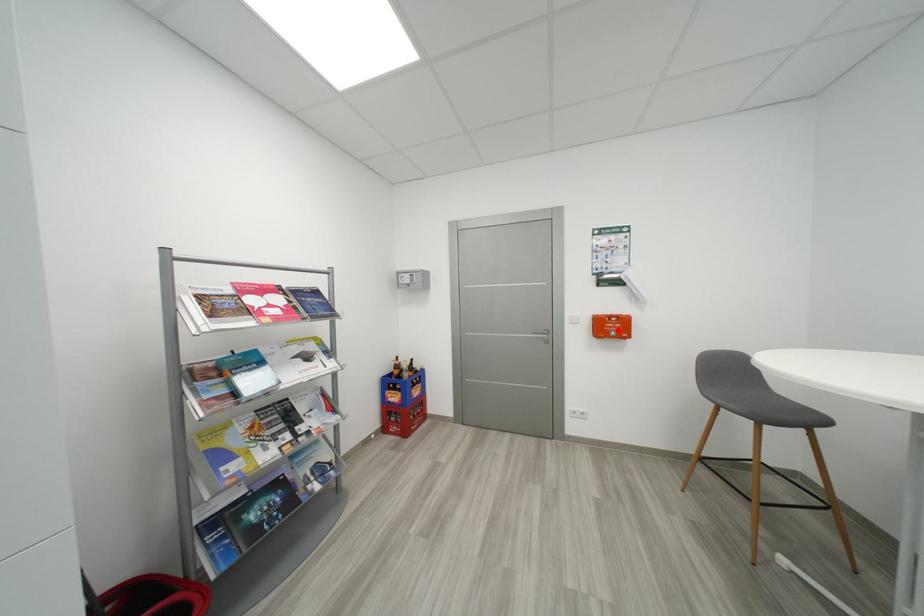
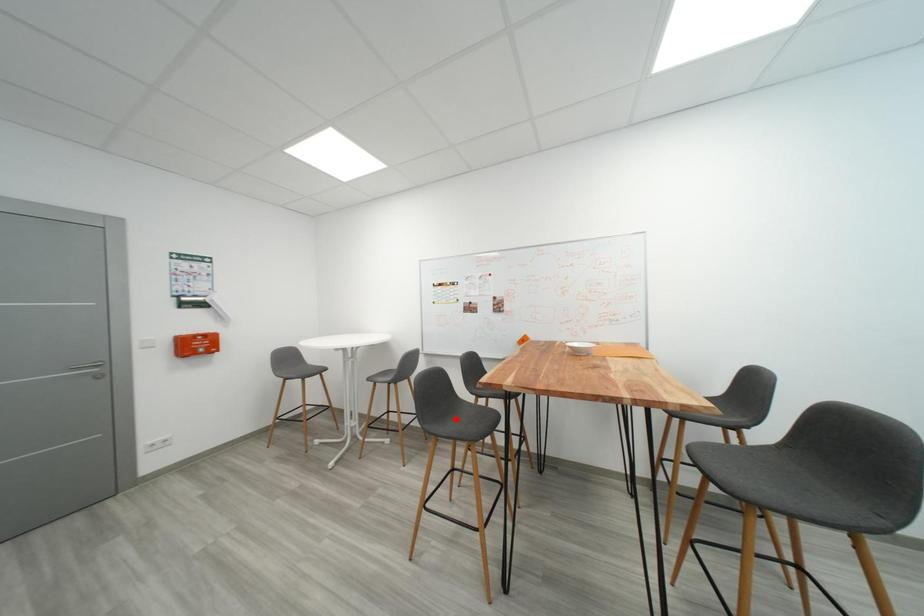
I am providing you with two images of the same scene from different viewpoints. A red point is marked on the first image and another point is marked on the second image. Is the red point in image1 aligned with the point shown in image2?

No